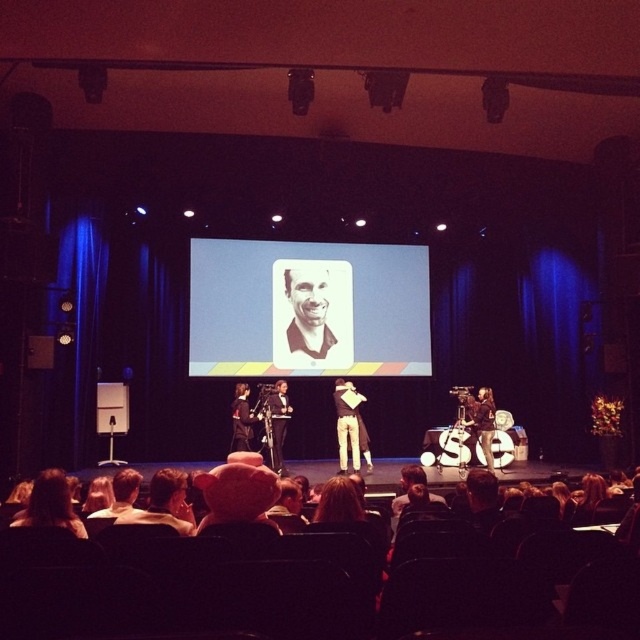
Which is below, white cotton shirt at center or matte black suit at center?

white cotton shirt at center

Measure the distance from white cotton shirt at center to matte black suit at center.

white cotton shirt at center and matte black suit at center are 1.42 meters apart.

Measure the distance between white cotton shirt at center and camera.

A distance of 10.45 meters exists between white cotton shirt at center and camera.

You are a GUI agent. You are given a task and a screenshot of the screen. Output one action in this format:
    pyautogui.click(x=<x>, y=<y>)
    Task: Click on the white cotton shirt at center
    
    Given the screenshot: What is the action you would take?
    pyautogui.click(x=348, y=422)

Is point (244, 317) less distant than point (308, 280)?

Yes, it is in front of point (308, 280).

Is white paper at center bigger than matte black shirt at center?

Indeed, white paper at center has a larger size compared to matte black shirt at center.

Locate an element on the screen. white paper at center is located at coordinates (307, 308).

Between point (282, 400) and point (241, 428), which one is positioned in front?

Point (241, 428)

Which is more to the left, black suit at center or matte black suit at center?

From the viewer's perspective, matte black suit at center appears more on the left side.

Where is `black suit at center`? The width and height of the screenshot is (640, 640). black suit at center is located at coordinates (278, 422).